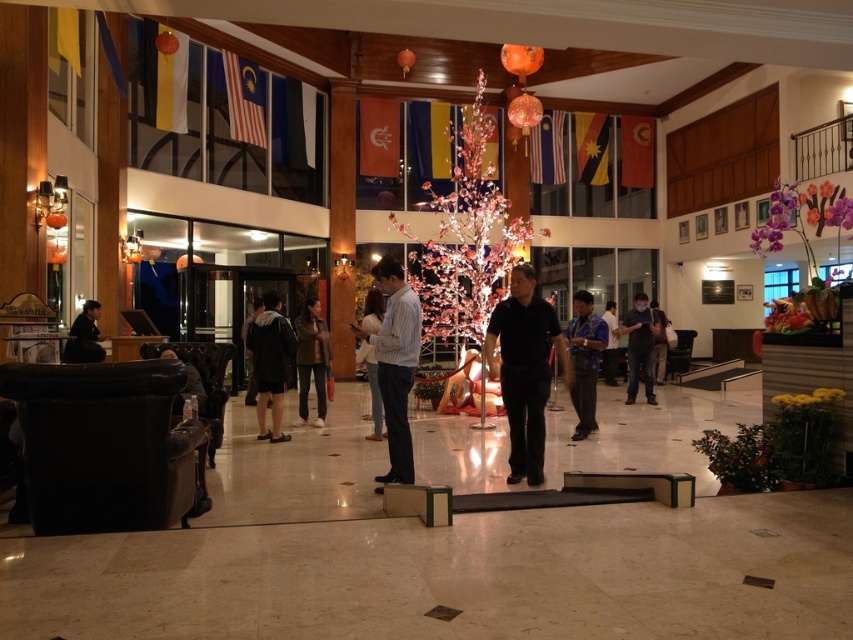
Based on the photo, can you confirm if blue patterned shirt at center is shorter than light beige sweater at center?

No, blue patterned shirt at center is not shorter than light beige sweater at center.

Is point (577, 435) closer to viewer compared to point (372, 384)?

No, (577, 435) is behind (372, 384).

Where is `blue patterned shirt at center`? This screenshot has height=640, width=853. blue patterned shirt at center is located at coordinates (584, 360).

Between point (592, 307) and point (605, 310), which one is positioned behind?

The point (605, 310) is behind.

Between blue patterned shirt at center and blue fabric shirt at center, which one has more height?

blue patterned shirt at center

Does point (583, 376) lie behind point (614, 307)?

No, (583, 376) is closer to viewer.

The width and height of the screenshot is (853, 640). In order to click on blue patterned shirt at center in this screenshot , I will do [x=584, y=360].

Which is in front, point (515, 365) or point (589, 392)?

Positioned in front is point (515, 365).

Does black matte shirt at center have a larger size compared to blue patterned shirt at center?

Correct, black matte shirt at center is larger in size than blue patterned shirt at center.

Is point (508, 344) less distant than point (579, 333)?

Yes.

At what (x,y) coordinates should I click in order to perform the action: click on black matte shirt at center. Please return your answer as a coordinate pair (x, y). The width and height of the screenshot is (853, 640). Looking at the image, I should click on (525, 369).